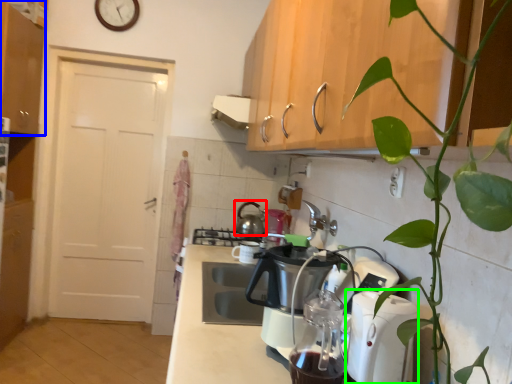
Question: Which is farther away from kitchen appliance (highlighted by a red box)? cabinetry (highlighted by a blue box) or kitchen appliance (highlighted by a green box)?

Choices:
 (A) cabinetry
 (B) kitchen appliance

Answer: (B)